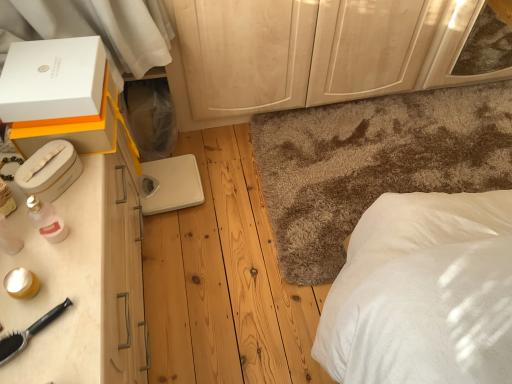
Question: Considering the relative sizes of white plastic scale at center and shaggy carpet at center in the image provided, is white plastic scale at center thinner than shaggy carpet at center?

Choices:
 (A) no
 (B) yes

Answer: (B)

Question: From a real-world perspective, does white plastic scale at center stand above shaggy carpet at center?

Choices:
 (A) no
 (B) yes

Answer: (B)

Question: Can you confirm if white plastic scale at center is taller than shaggy carpet at center?

Choices:
 (A) yes
 (B) no

Answer: (B)

Question: Is white plastic scale at center at the right side of shaggy carpet at center?

Choices:
 (A) no
 (B) yes

Answer: (A)

Question: From a real-world perspective, is white plastic scale at center positioned under shaggy carpet at center based on gravity?

Choices:
 (A) yes
 (B) no

Answer: (B)

Question: Considering the positions of light wood dresser at center and shaggy carpet at center in the image, is light wood dresser at center bigger or smaller than shaggy carpet at center?

Choices:
 (A) big
 (B) small

Answer: (B)

Question: Does point (330, 21) appear closer or farther from the camera than point (273, 215)?

Choices:
 (A) closer
 (B) farther

Answer: (A)

Question: Considering the positions of light wood dresser at center and shaggy carpet at center in the image, is light wood dresser at center wider or thinner than shaggy carpet at center?

Choices:
 (A) thin
 (B) wide

Answer: (A)

Question: From a real-world perspective, relative to shaggy carpet at center, is light wood dresser at center vertically above or below?

Choices:
 (A) below
 (B) above

Answer: (B)

Question: Is point (23, 172) positioned closer to the camera than point (40, 233)?

Choices:
 (A) closer
 (B) farther

Answer: (B)

Question: Relative to pink glass perfume at left, is white plastic box at left, which appears as the 3th box when viewed from the top, in front or behind?

Choices:
 (A) front
 (B) behind

Answer: (B)

Question: Looking at the image, does white plastic box at left, which appears as the 3th box when viewed from the top, seem bigger or smaller compared to pink glass perfume at left?

Choices:
 (A) big
 (B) small

Answer: (A)

Question: From the image's perspective, is white plastic box at left, marked as the 1th box in a bottom-to-top arrangement, above or below pink glass perfume at left?

Choices:
 (A) below
 (B) above

Answer: (B)

Question: In terms of width, does white cardboard box at upper left, the 2th box ordered from the bottom, look wider or thinner when compared to white matte box at upper left, which ranks as the 3th box in bottom-to-top order?

Choices:
 (A) wide
 (B) thin

Answer: (B)

Question: Looking at the image, does white cardboard box at upper left, the 2th box ordered from the bottom, seem bigger or smaller compared to white matte box at upper left, which ranks as the 3th box in bottom-to-top order?

Choices:
 (A) small
 (B) big

Answer: (B)